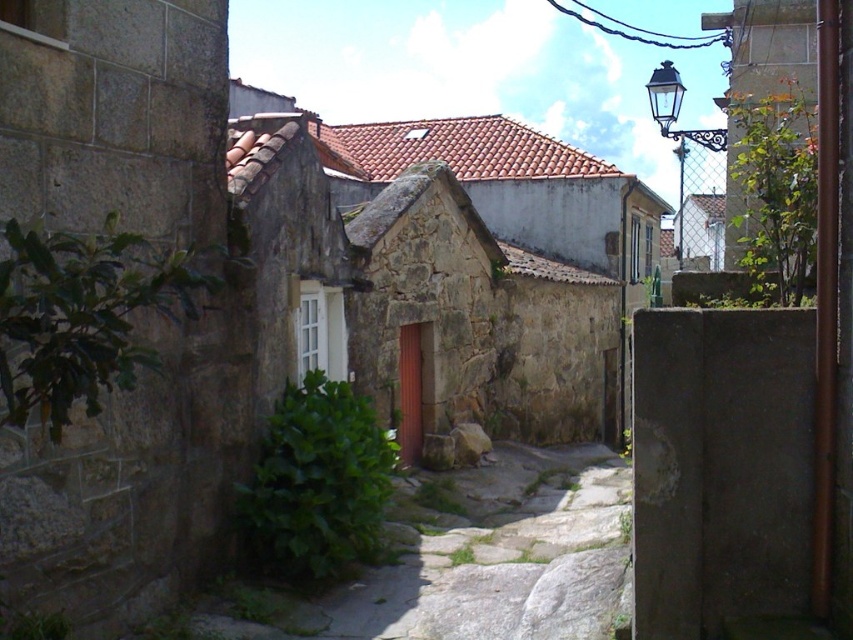
You are a tourist walking down the narrow alleyway and want to take a photo of the black wrought iron streetlight at upper right. To get a clear shot, you need to stand on the green mossy stone path at center. Is the path on the correct side to do this?

The green mossy stone path at center is positioned on the left side of the black wrought iron streetlight at upper right, so standing on it would place you to the left of the streetlight, allowing you to take a clear photo.

You are standing at the entrance of the alleyway and want to reach the red door in the center. The green mossy stone path at center is your only path. Can you walk straight ahead from your current position to reach the red door without deviating from the path?

Yes, since the green mossy stone path at center is positioned at point (503, 554), which aligns with the center of the alleyway, you can walk straight ahead to reach the red door without deviating from the path.